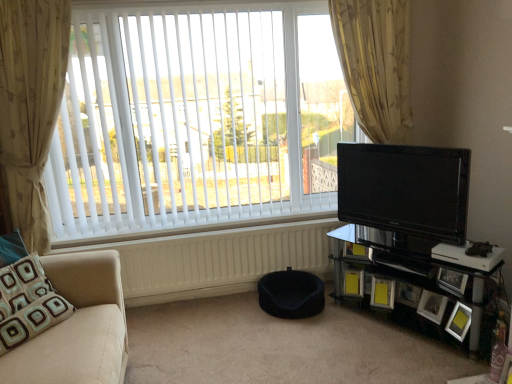
This screenshot has height=384, width=512. What are the coordinates of `black fabric bean bag at center` in the screenshot? It's located at (291, 294).

This screenshot has height=384, width=512. Find the location of `black fabric pet bed at lower center`. black fabric pet bed at lower center is located at coordinates (282, 347).

This screenshot has height=384, width=512. Find the location of `teal fabric pillow at lower left`. teal fabric pillow at lower left is located at coordinates (28, 303).

You are a GUI agent. You are given a task and a screenshot of the screen. Output one action in this format:
    pyautogui.click(x=<x>, y=<y>)
    Task: Click on the gold floral fabric curtain at upper right, arranged as the first curtain when viewed from the right
    
    Given the screenshot: What is the action you would take?
    tap(375, 64)

Describe the element at coordinates (77, 327) in the screenshot. Image resolution: width=512 pixels, height=384 pixels. I see `beige fabric studio couch at left` at that location.

You are a GUI agent. You are given a task and a screenshot of the screen. Output one action in this format:
    pyautogui.click(x=<x>, y=<y>)
    Task: Click on the wooden photo frame at lower right, which appears as the fifth picture frame when viewed from the left
    
    Given the screenshot: What is the action you would take?
    pyautogui.click(x=452, y=280)

Where is `black fabric bean bag at center`? The width and height of the screenshot is (512, 384). black fabric bean bag at center is located at coordinates (291, 294).

Is black glass entertainment center at lower right directly adjacent to white plastic blinds at upper center?

No, black glass entertainment center at lower right is not touching white plastic blinds at upper center.

Is black glass entertainment center at lower right smaller than white plastic blinds at upper center?

Yes, black glass entertainment center at lower right is smaller than white plastic blinds at upper center.

Is white plastic blinds at upper center located within black glass entertainment center at lower right?

Actually, white plastic blinds at upper center is outside black glass entertainment center at lower right.

Which of these two, black glass entertainment center at lower right or white plastic blinds at upper center, stands shorter?

Standing shorter between the two is black glass entertainment center at lower right.

From a real-world perspective, which object stands above the other?

In real-world perspective, white plastic blinds at upper center is above.

Is white plastic blinds at upper center at the right side of wooden picture frame at lower right, the 3th picture frame viewed from the right?

No.

Who is taller, white plastic blinds at upper center or wooden picture frame at lower right, the 3th picture frame viewed from the right?

white plastic blinds at upper center is taller.

Is white plastic blinds at upper center facing towards wooden picture frame at lower right, marked as the 4th picture frame in a left-to-right arrangement?

No, white plastic blinds at upper center is not facing towards wooden picture frame at lower right, marked as the 4th picture frame in a left-to-right arrangement.

Is black glossy tv at right wider or thinner than black fabric pet bed at lower center?

Considering their sizes, black glossy tv at right looks slimmer than black fabric pet bed at lower center.

Relative to black fabric pet bed at lower center, is black glossy tv at right in front or behind?

Visually, black glossy tv at right is located behind black fabric pet bed at lower center.

Which is in front, point (391, 148) or point (262, 358)?

The point (262, 358) is closer.

Is black glossy tv at right not near black fabric pet bed at lower center?

No, black glossy tv at right is not far from black fabric pet bed at lower center.

How much distance is there between black fabric pet bed at lower center and black glass entertainment center at lower right?

black fabric pet bed at lower center is 29.66 inches away from black glass entertainment center at lower right.

Is black fabric pet bed at lower center next to black glass entertainment center at lower right?

No, black fabric pet bed at lower center is not with black glass entertainment center at lower right.

Who is smaller, black fabric pet bed at lower center or black glass entertainment center at lower right?

Smaller between the two is black glass entertainment center at lower right.

Can you confirm if black fabric pet bed at lower center is taller than black glass entertainment center at lower right?

Incorrect, the height of black fabric pet bed at lower center is not larger of that of black glass entertainment center at lower right.

Is white plastic blinds at upper center shorter than wooden photo frame at lower right, which is the 2th picture frame in right-to-left order?

In fact, white plastic blinds at upper center may be taller than wooden photo frame at lower right, which is the 2th picture frame in right-to-left order.

Is white plastic blinds at upper center oriented away from wooden photo frame at lower right, which is the 2th picture frame in right-to-left order?

That's not correct — white plastic blinds at upper center is not looking away from wooden photo frame at lower right, which is the 2th picture frame in right-to-left order.

Considering their positions, is white plastic blinds at upper center located in front of or behind wooden photo frame at lower right, which appears as the fifth picture frame when viewed from the left?

Visually, white plastic blinds at upper center is located behind wooden photo frame at lower right, which appears as the fifth picture frame when viewed from the left.

Does teal fabric pillow at lower left lie in front of yellow paper at lower right, which is the fifth picture frame from right to left?

Yes, the depth of teal fabric pillow at lower left is less than that of yellow paper at lower right, which is the fifth picture frame from right to left.

Considering the sizes of teal fabric pillow at lower left and yellow paper at lower right, the 2th picture frame when ordered from left to right, in the image, is teal fabric pillow at lower left taller or shorter than yellow paper at lower right, the 2th picture frame when ordered from left to right,?

Clearly, teal fabric pillow at lower left is taller compared to yellow paper at lower right, the 2th picture frame when ordered from left to right.

Is teal fabric pillow at lower left far away from yellow paper at lower right, which is the fifth picture frame from right to left?

Yes, teal fabric pillow at lower left and yellow paper at lower right, which is the fifth picture frame from right to left, are quite far apart.

Which is behind, point (45, 290) or point (394, 292)?

Positioned behind is point (394, 292).

From the image's perspective, which one is positioned lower, white plastic blinds at upper center or black fabric pet bed at lower center?

black fabric pet bed at lower center appears lower in the image.

Does white plastic blinds at upper center lie in front of black fabric pet bed at lower center?

No, white plastic blinds at upper center is further to the viewer.

Is white plastic blinds at upper center spatially inside black fabric pet bed at lower center, or outside of it?

white plastic blinds at upper center is outside black fabric pet bed at lower center.

Locate an element on the screen. entertainment center below the white plastic blinds at upper center (from a real-world perspective) is located at coordinates (406, 204).

Starting from the white plastic blinds at upper center, which picture frame is the 4th one to the right? Please provide its 2D coordinates.

[(432, 306)]

Estimate the real-world distances between objects in this image. Which object is further from matte black picture frame at lower right, placed as the fourth picture frame when sorted from right to left, black fabric bean bag at center or white matte radiator at lower center?

white matte radiator at lower center lies further to matte black picture frame at lower right, placed as the fourth picture frame when sorted from right to left, than the other object.

Based on their spatial positions, is white matte radiator at lower center or black fabric pet bed at lower center closer to black fabric bean bag at center?

black fabric pet bed at lower center lies closer to black fabric bean bag at center than the other object.

From the image, which object appears to be farther from black fabric pet bed at lower center, yellow matte picture frame at lower right, arranged as the first picture frame when viewed from the right, or gold floral fabric curtain at upper right, positioned as the second curtain in left-to-right order?

Based on the image, gold floral fabric curtain at upper right, positioned as the second curtain in left-to-right order, appears to be further to black fabric pet bed at lower center.

From the image, which object appears to be nearer to wooden picture frame at lower right, marked as the 4th picture frame in a left-to-right arrangement, yellow matte picture frame at lower right, positioned as the 6th picture frame in left-to-right order, or beige fabric studio couch at left?

yellow matte picture frame at lower right, positioned as the 6th picture frame in left-to-right order, lies closer to wooden picture frame at lower right, marked as the 4th picture frame in a left-to-right arrangement, than the other object.

Which object lies further to the anchor point wooden photo frame at lower right, which appears as the fifth picture frame when viewed from the left, black fabric pet bed at lower center or beige fabric studio couch at left?

beige fabric studio couch at left lies further to wooden photo frame at lower right, which appears as the fifth picture frame when viewed from the left, than the other object.

When comparing their distances from black fabric bean bag at center, does gold floral fabric curtain at upper right, positioned as the second curtain in left-to-right order, or yellow matte picture frame at lower right, positioned as the 6th picture frame in left-to-right order, seem further?

The object further to black fabric bean bag at center is gold floral fabric curtain at upper right, positioned as the second curtain in left-to-right order.

When comparing their distances from black fabric bean bag at center, does gold floral fabric curtain at upper right, arranged as the first curtain when viewed from the right, or black glass entertainment center at lower right seem further?

gold floral fabric curtain at upper right, arranged as the first curtain when viewed from the right, is further to black fabric bean bag at center.

Estimate the real-world distances between objects in this image. Which object is closer to matte black picture frame at lower right, placed as the fourth picture frame when sorted from right to left, white matte radiator at lower center or beige fabric studio couch at left?

white matte radiator at lower center is positioned closer to the anchor matte black picture frame at lower right, placed as the fourth picture frame when sorted from right to left.

The image size is (512, 384). Identify the location of pillow situated between beige floral fabric curtain at left, which is the second curtain from right to left, and wooden picture frame at lower right, the 3th picture frame viewed from the right, from left to right. (28, 303).

Find the location of a particular element. The height and width of the screenshot is (384, 512). curtain located between beige floral fabric curtain at left, which is the second curtain from right to left, and matte black picture frame at lower right, which appears as the third picture frame when viewed from the left, in the left-right direction is located at coordinates (375, 64).

I want to click on television between black glass entertainment center at lower right and yellow matte picture frame at lower right, which is the 6th picture frame from right to left, from front to back, so click(405, 189).

Locate an element on the screen. Image resolution: width=512 pixels, height=384 pixels. bean bag chair between teal fabric pillow at lower left and black glass entertainment center at lower right from left to right is located at coordinates (291, 294).